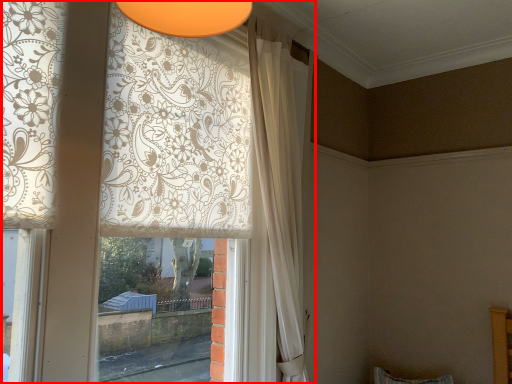
Question: In this image, where is curtain (annotated by the red box) located relative to curtain?

Choices:
 (A) right
 (B) left

Answer: (B)